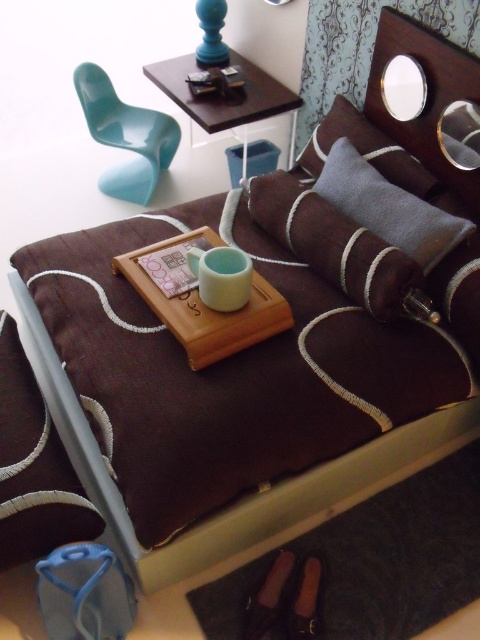
Question: Is brown textured pillow at center to the right of wooden tray at center from the viewer's perspective?

Choices:
 (A) yes
 (B) no

Answer: (A)

Question: Is the position of brown textured pillow at center less distant than that of dark wood table at upper center?

Choices:
 (A) no
 (B) yes

Answer: (B)

Question: Which point is closer to the camera taking this photo?

Choices:
 (A) (153, 147)
 (B) (398, 292)
 (C) (330, 196)

Answer: (B)

Question: Does brown textured pillow at center lie in front of suede-like brown pillow at upper right?

Choices:
 (A) no
 (B) yes

Answer: (B)

Question: Which point appears farthest from the camera in this image?

Choices:
 (A) (290, 93)
 (B) (405, 202)
 (C) (263, 333)

Answer: (A)

Question: Which point appears farthest from the camera in this image?

Choices:
 (A) (105, 192)
 (B) (350, 262)
 (C) (419, 52)
 (D) (228, 348)

Answer: (A)